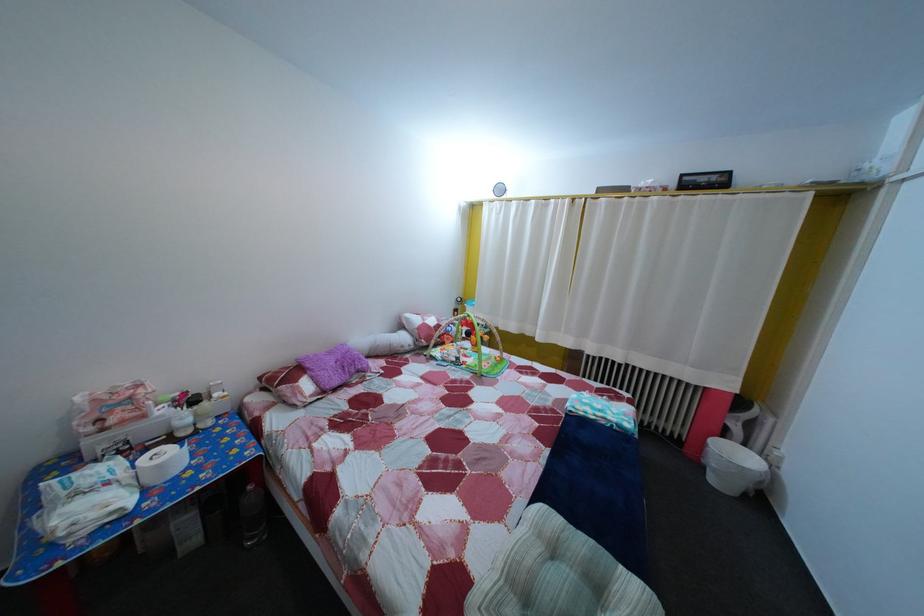
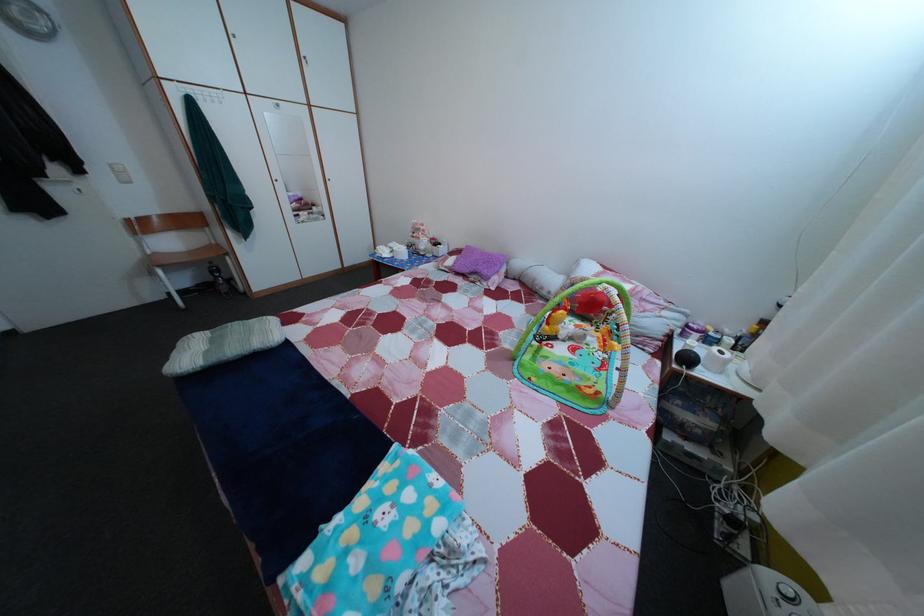
The point at (417, 355) is marked in the first image. Where is the corresponding point in the second image?

(553, 301)